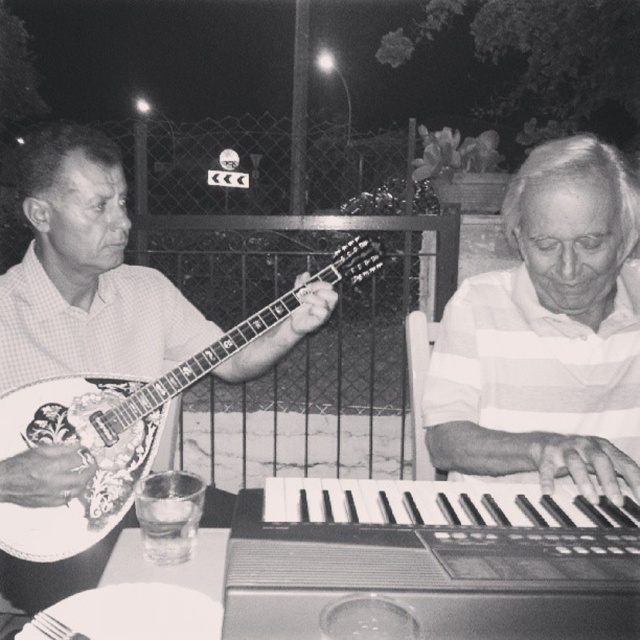
You are a photographer adjusting the focus on your camera. You have two points in the image you need to focus on, point (506, 401) and point (70, 385). Since you can only focus on one point at a time, which point should you choose to ensure the person closer to the camera is in focus?

Point (506, 401) should be chosen because it is closer to the viewer than point (70, 385), ensuring the person closer to the camera is in focus.

You are a photographer adjusting the focus on your camera. You want to ensure both the white striped shirt at right and the decorative wood mandolin at left are in clear focus. Since the camera can only focus on one object at a time, which object should you prioritize focusing on to ensure the other is also in focus?

The white striped shirt at right is thinner than the decorative wood mandolin at left, so focusing on the decorative wood mandolin at left would create a deeper depth of field, allowing the thinner white striped shirt at right to also be in focus.